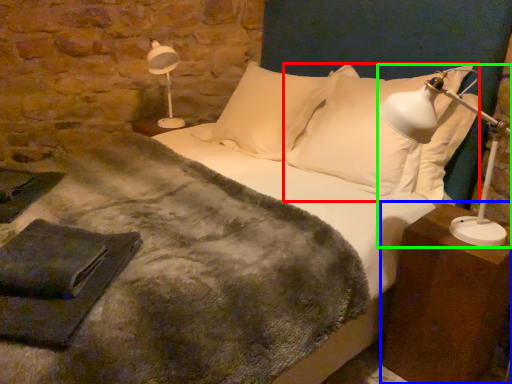
Question: Which is farther away from pillow (highlighted by a red box)? nightstand (highlighted by a blue box) or table lamp (highlighted by a green box)?

Choices:
 (A) nightstand
 (B) table lamp

Answer: (A)